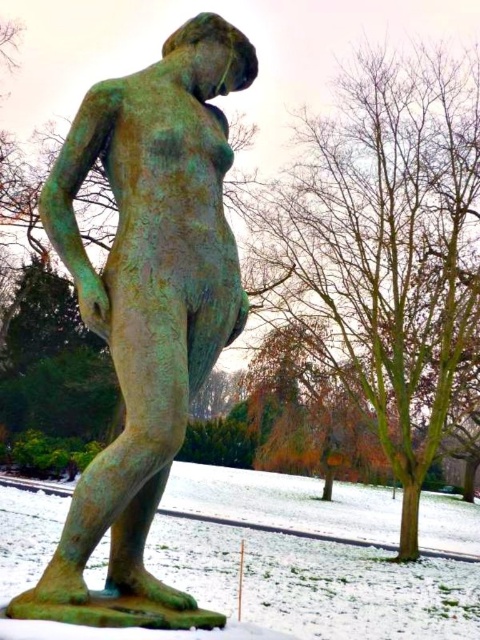
Question: Does green patina bronze statue at center have a greater width compared to green patina snow at lower left?

Choices:
 (A) no
 (B) yes

Answer: (A)

Question: Which point is closer to the camera?

Choices:
 (A) green patina bronze statue at center
 (B) green patina snow at lower left

Answer: (A)

Question: Which of the following is the farthest from the observer?

Choices:
 (A) green patina bronze statue at center
 (B) green patina snow at lower left

Answer: (B)

Question: Can you confirm if green patina bronze statue at center is bigger than green patina snow at lower left?

Choices:
 (A) yes
 (B) no

Answer: (B)

Question: Is green patina bronze statue at center closer to camera compared to green patina snow at lower left?

Choices:
 (A) yes
 (B) no

Answer: (A)